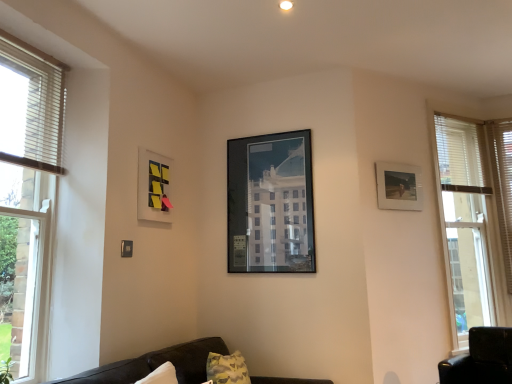
Question: Is dark brown leather couch at lower center shorter than matte wooden picture frame at right, placed as the 3th picture frame when sorted from left to right?

Choices:
 (A) yes
 (B) no

Answer: (B)

Question: Is dark brown leather couch at lower center to the left of matte wooden picture frame at right, which is counted as the first picture frame, starting from the right, from the viewer's perspective?

Choices:
 (A) no
 (B) yes

Answer: (B)

Question: Considering the relative positions of dark brown leather couch at lower center and matte wooden picture frame at right, which is counted as the first picture frame, starting from the right, in the image provided, is dark brown leather couch at lower center to the right of matte wooden picture frame at right, which is counted as the first picture frame, starting from the right, from the viewer's perspective?

Choices:
 (A) no
 (B) yes

Answer: (A)

Question: From a real-world perspective, is dark brown leather couch at lower center located higher than matte wooden picture frame at right, placed as the 3th picture frame when sorted from left to right?

Choices:
 (A) yes
 (B) no

Answer: (B)

Question: Can you confirm if dark brown leather couch at lower center is bigger than matte wooden picture frame at right, which is counted as the first picture frame, starting from the right?

Choices:
 (A) yes
 (B) no

Answer: (A)

Question: Is matte wooden picture frame at right, placed as the 3th picture frame when sorted from left to right, completely or partially inside dark brown leather couch at lower center?

Choices:
 (A) no
 (B) yes

Answer: (A)

Question: Can you confirm if matte plastic picture frame at upper left, acting as the first picture frame starting from the left, is thinner than clear glass window at left?

Choices:
 (A) yes
 (B) no

Answer: (A)

Question: Can you confirm if matte plastic picture frame at upper left, acting as the first picture frame starting from the left, is wider than clear glass window at left?

Choices:
 (A) no
 (B) yes

Answer: (A)

Question: Could you tell me if matte plastic picture frame at upper left, acting as the first picture frame starting from the left, is turned towards clear glass window at left?

Choices:
 (A) no
 (B) yes

Answer: (A)

Question: Could clear glass window at left be considered to be inside matte plastic picture frame at upper left, which appears as the 3th picture frame when viewed from the right?

Choices:
 (A) no
 (B) yes

Answer: (A)

Question: Considering the relative positions of matte plastic picture frame at upper left, acting as the first picture frame starting from the left, and clear glass window at left in the image provided, is matte plastic picture frame at upper left, acting as the first picture frame starting from the left, to the right of clear glass window at left from the viewer's perspective?

Choices:
 (A) no
 (B) yes

Answer: (B)

Question: Is matte plastic picture frame at upper left, which appears as the 3th picture frame when viewed from the right, to the left of clear glass window at left from the viewer's perspective?

Choices:
 (A) no
 (B) yes

Answer: (A)

Question: Is dark brown leather couch at lower center facing towards matte plastic picture frame at upper left, acting as the first picture frame starting from the left?

Choices:
 (A) no
 (B) yes

Answer: (A)